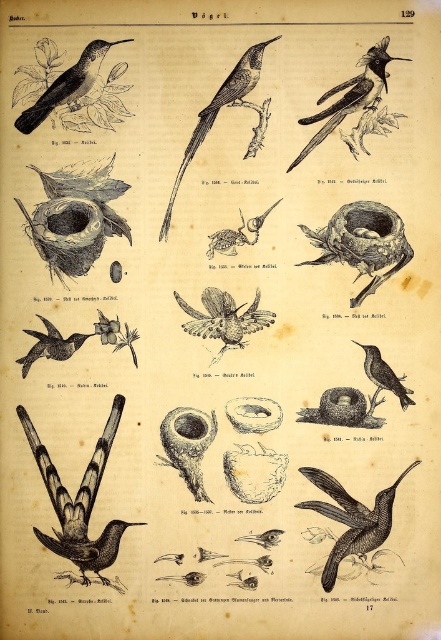
Question: Which of the following is the farthest from the observer?

Choices:
 (A) (310, 148)
 (B) (182, 172)

Answer: (B)

Question: Does smooth brown bird at center appear on the right side of smooth gray bird at center?

Choices:
 (A) yes
 (B) no

Answer: (B)

Question: Can you confirm if black glossy hummingbird at upper right is wider than smooth gray bird at center?

Choices:
 (A) yes
 (B) no

Answer: (A)

Question: Is black glossy hummingbird at lower left to the right of smooth brown bird at center from the viewer's perspective?

Choices:
 (A) no
 (B) yes

Answer: (A)

Question: Which point appears farthest from the camera in this image?

Choices:
 (A) (372, 538)
 (B) (227, 232)
 (C) (29, 330)
 (D) (231, 76)

Answer: (B)

Question: Estimate the real-world distances between objects in this image. Which object is farther from the smooth brown bird at center?

Choices:
 (A) black glossy hummingbird at center
 (B) black glossy hummingbird at lower left
 (C) smooth brown bird at center right

Answer: (A)